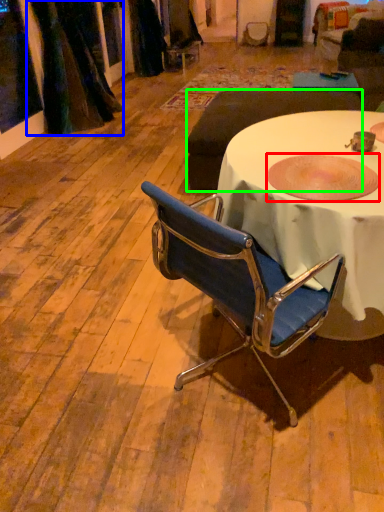
Question: Based on their relative distances, which object is farther from bowl (highlighted by a red box)? Choose from curtain (highlighted by a blue box) and studio couch (highlighted by a green box).

Choices:
 (A) curtain
 (B) studio couch

Answer: (A)